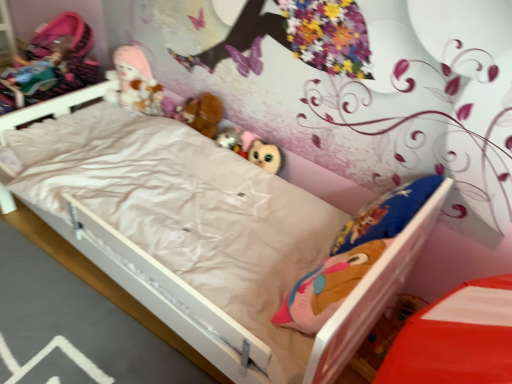
Question: From the image's perspective, relative to fluffy plush toys at upper center, which is the 3th toy from right to left, is matte plush owl at center, acting as the third toy starting from the top, above or below?

Choices:
 (A) below
 (B) above

Answer: (A)

Question: Considering their positions, is matte plush owl at center, the 1th toy positioned from the right, located in front of or behind fluffy plush toys at upper center, acting as the first toy starting from the back?

Choices:
 (A) front
 (B) behind

Answer: (A)

Question: Which object is the closest to the matte plush owl at center, the first toy from the front?

Choices:
 (A) white matte bed at center
 (B) fluffy plush toys at upper center, which is the first toy from left to right
 (C) brown plush at center, the second doll from the left
 (D) matte pink fabric doll at upper left, which is the 2th doll from right to left
 (E) fuzzy fabric plush at center, the 2th toy positioned from the bottom

Answer: (E)

Question: Estimate the real-world distances between objects in this image. Which object is closer to the matte plush owl at center, the first toy from the front?

Choices:
 (A) fluffy plush toys at upper center, which is the 3th toy from right to left
 (B) white matte bed at center
 (C) fuzzy fabric plush at center, arranged as the second toy when viewed from the top
 (D) matte pink fabric doll at upper left, the first doll from the left
 (E) brown plush at center, arranged as the first doll when viewed from the right

Answer: (C)